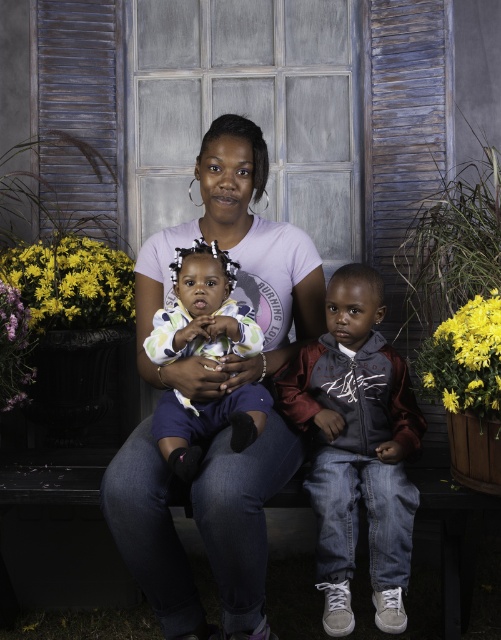
Question: Does velvet maroon hoodie at center have a lesser width compared to yellow matte flowers at left?

Choices:
 (A) no
 (B) yes

Answer: (B)

Question: Which point is closer to the camera?

Choices:
 (A) (437, 388)
 (B) (87, 253)
 (C) (397, 532)
 (D) (320, 276)

Answer: (C)

Question: Which point is closer to the camera?

Choices:
 (A) (498, 380)
 (B) (210, 336)

Answer: (B)

Question: Does purple cotton shirt at center have a smaller size compared to velvet maroon hoodie at center?

Choices:
 (A) no
 (B) yes

Answer: (A)

Question: Which object is positioned farthest from the purple cotton shirt at center?

Choices:
 (A) yellow matte flowers at right
 (B) yellow matte flowers at left

Answer: (B)

Question: Is soft pastel onesie at center smaller than yellow matte flowers at right?

Choices:
 (A) yes
 (B) no

Answer: (B)